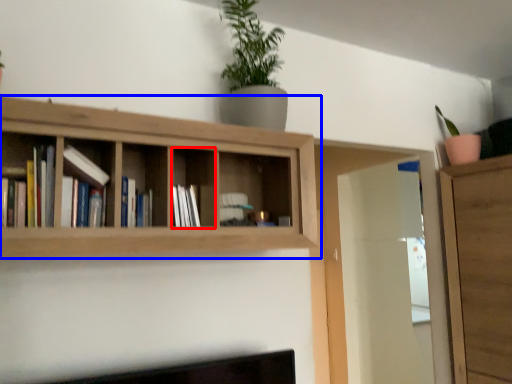
Question: Which object appears farthest to the camera in this image, cabinet (highlighted by a red box) or shelf (highlighted by a blue box)?

Choices:
 (A) cabinet
 (B) shelf

Answer: (A)